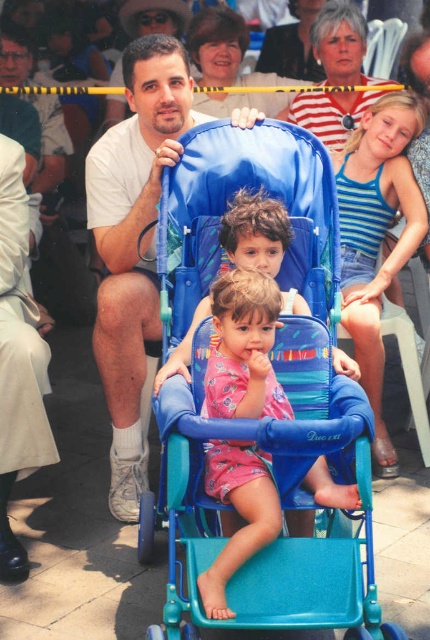
How far apart are matte white shirt at upper left and pink fabric baby at center?

3.90 feet

Measure the distance between matte white shirt at upper left and camera.

The distance of matte white shirt at upper left from camera is 4.43 meters.

The width and height of the screenshot is (430, 640). What are the coordinates of `matte white shirt at upper left` in the screenshot? It's located at (134, 246).

Looking at this image, is blue fabric stroller at center positioned before pink fabric baby at center?

That is True.

Is blue fabric stroller at center to the left of pink fabric baby at center from the viewer's perspective?

No, blue fabric stroller at center is not to the left of pink fabric baby at center.

Does point (168, 611) come farther from viewer compared to point (245, 536)?

No, it is in front of (245, 536).

The width and height of the screenshot is (430, 640). In order to click on blue fabric stroller at center in this screenshot , I will do `click(276, 332)`.

Is blue fabric stroller at center to the right of matte white shirt at upper left from the viewer's perspective?

Indeed, blue fabric stroller at center is positioned on the right side of matte white shirt at upper left.

The height and width of the screenshot is (640, 430). Describe the element at coordinates (276, 332) in the screenshot. I see `blue fabric stroller at center` at that location.

I want to click on blue fabric stroller at center, so click(276, 332).